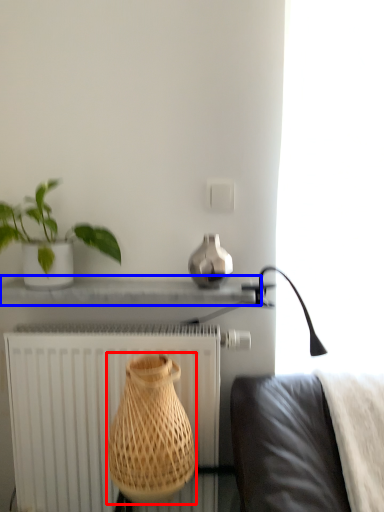
Question: Which point is further to the camera, vase (highlighted by a red box) or window sill (highlighted by a blue box)?

Choices:
 (A) vase
 (B) window sill

Answer: (B)